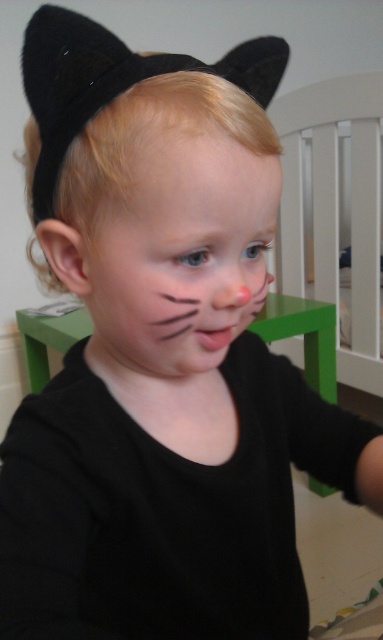
Which of these two, matte black face at center or smooth skin at center, stands taller?

matte black face at center

Which is in front, point (204, 195) or point (199, 134)?

Point (204, 195)

Find the location of `matte black face at center`. matte black face at center is located at coordinates [180, 257].

At what (x,y) coordinates should I click in order to perform the action: click on matte black face at center. Please return your answer as a coordinate pair (x, y). This screenshot has height=640, width=383. Looking at the image, I should click on (180, 257).